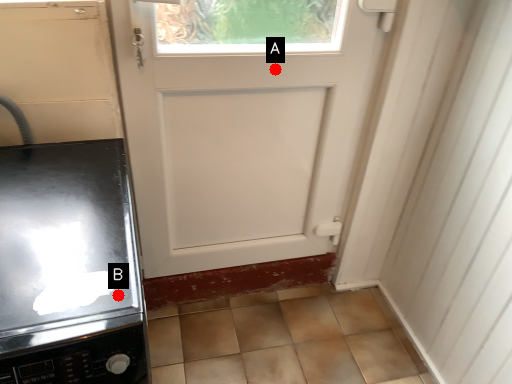
Question: Two points are circled on the image, labeled by A and B beside each circle. Which point is closer to the camera?

Choices:
 (A) A is closer
 (B) B is closer

Answer: (B)